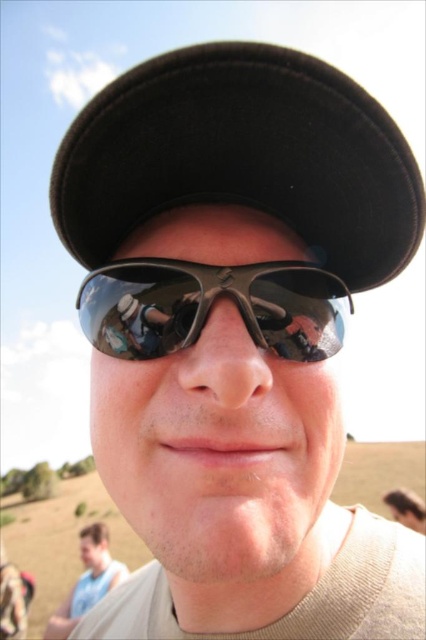
Which is in front, point (386, 220) or point (270, 317)?

Point (270, 317)

Does point (371, 182) come in front of point (253, 276)?

No, (371, 182) is behind (253, 276).

Locate an element on the screen. black felt baseball hat at upper center is located at coordinates (241, 157).

Which of these two, shiny black goggles at center or light blue shirt at lower left, stands shorter?

shiny black goggles at center

Does shiny black goggles at center have a greater width compared to light blue shirt at lower left?

No.

Find the location of `shiny black goggles at center`. shiny black goggles at center is located at coordinates (210, 307).

Which of these two, black felt baseball hat at upper center or light blue shirt at lower left, stands taller?

light blue shirt at lower left

Who is higher up, black felt baseball hat at upper center or light blue shirt at lower left?

Positioned higher is black felt baseball hat at upper center.

Is point (359, 200) less distant than point (86, 561)?

Yes, point (359, 200) is closer to viewer.

Where is `black felt baseball hat at upper center`? The width and height of the screenshot is (426, 640). black felt baseball hat at upper center is located at coordinates (241, 157).